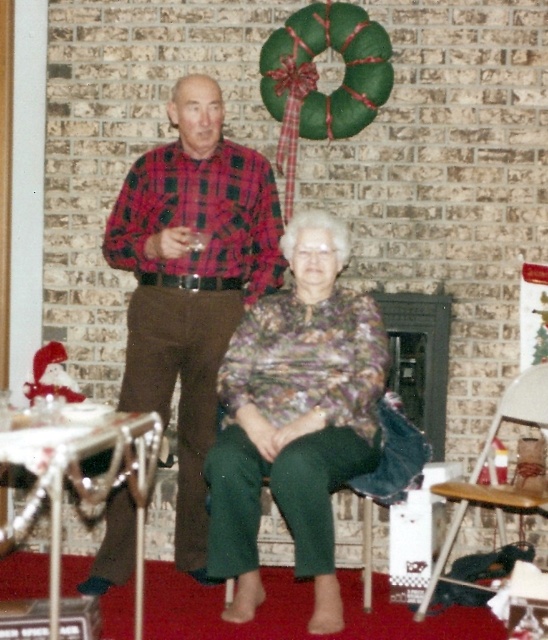
Measure the distance between plaid fabric shirt at center and printed fabric blouse at center.

plaid fabric shirt at center is 14.98 inches from printed fabric blouse at center.

Measure the distance between plaid fabric shirt at center and camera.

A distance of 3.50 meters exists between plaid fabric shirt at center and camera.

Image resolution: width=548 pixels, height=640 pixels. I want to click on plaid fabric shirt at center, so click(x=191, y=280).

Is printed fabric blouse at center to the left of wooden folding chair at lower right from the viewer's perspective?

Indeed, printed fabric blouse at center is positioned on the left side of wooden folding chair at lower right.

Is printed fabric blouse at center wider than wooden folding chair at lower right?

Indeed, printed fabric blouse at center has a greater width compared to wooden folding chair at lower right.

Is point (278, 346) positioned in front of point (533, 416)?

Yes.

The width and height of the screenshot is (548, 640). Identify the location of printed fabric blouse at center. (295, 419).

Which is behind, point (208, 202) or point (449, 536)?

Positioned behind is point (208, 202).

Describe the element at coordinates (191, 280) in the screenshot. The height and width of the screenshot is (640, 548). I see `plaid fabric shirt at center` at that location.

I want to click on plaid fabric shirt at center, so click(191, 280).